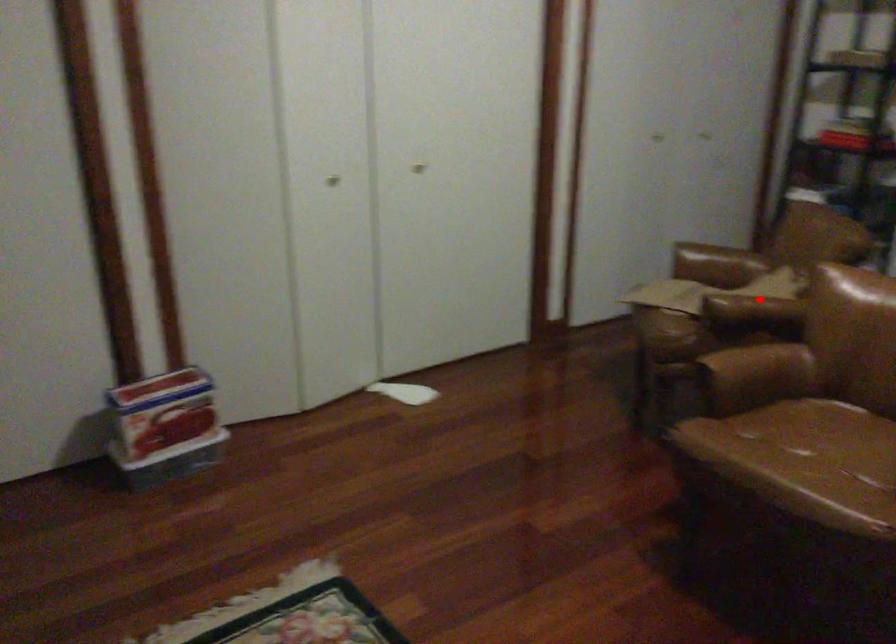
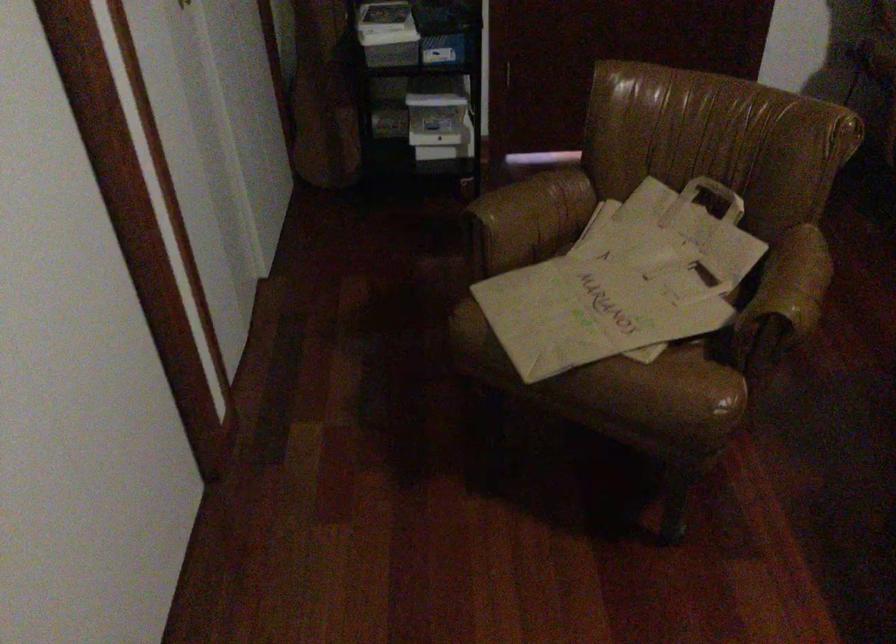
Find the pixel in the second image that matches the highlighted location in the first image.

(803, 275)